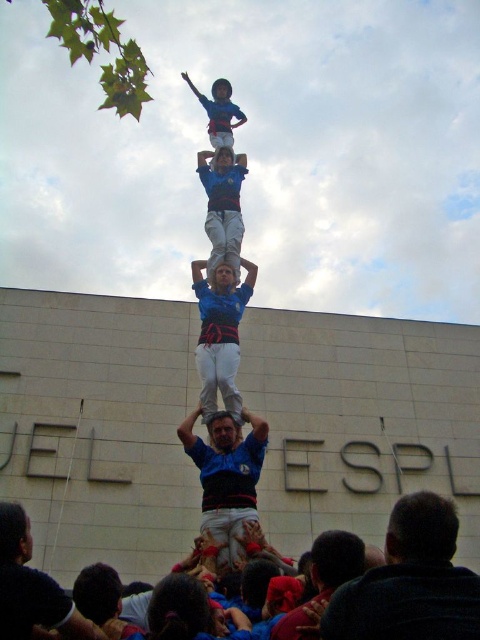
Question: In this image, where is blue fabric shirt at center located relative to blue fabric shirt at upper center?

Choices:
 (A) left
 (B) right

Answer: (B)

Question: Can you confirm if blue fabric man at center is bigger than blue fabric shirt at upper center?

Choices:
 (A) no
 (B) yes

Answer: (A)

Question: Estimate the real-world distances between objects in this image. Which object is farther from the blue fabric shirt at upper center?

Choices:
 (A) dark brown hair at lower right
 (B) blue fabric shirt at center

Answer: (A)

Question: Is dark brown hair at lower right positioned at the back of blue fabric shirt at upper center?

Choices:
 (A) yes
 (B) no

Answer: (B)

Question: Which object is closer to the camera taking this photo?

Choices:
 (A) blue fabric shirt at center
 (B) dark blue shirt at center
 (C) dark brown hair at lower right
 (D) blue fabric man at center

Answer: (C)

Question: Which object appears closest to the camera in this image?

Choices:
 (A) dark blue shirt at center
 (B) blue fabric shirt at center
 (C) blue fabric shirt at upper center

Answer: (A)